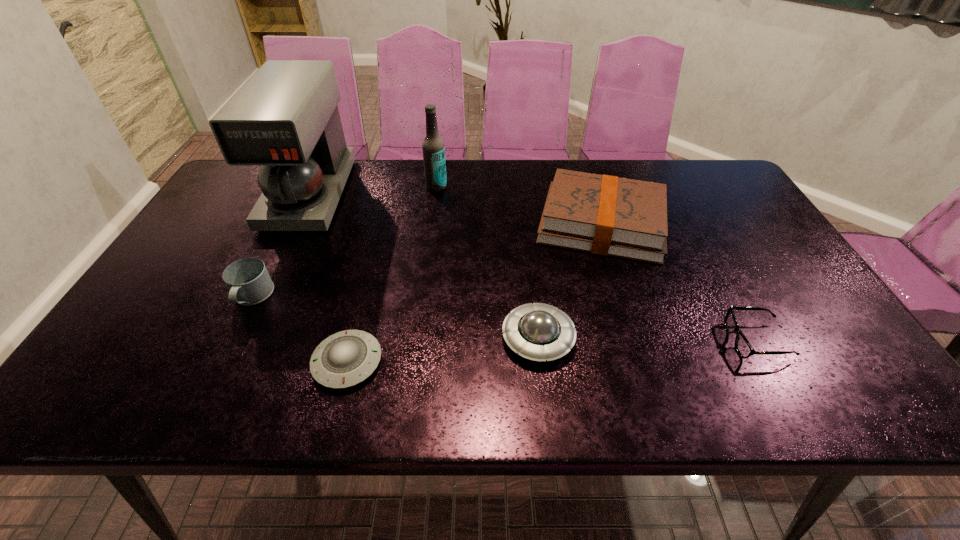
This screenshot has width=960, height=540. In order to click on hardback book present at the far edge in this screenshot , I will do `click(607, 215)`.

This screenshot has height=540, width=960. What are the coordinates of `object situated at the near edge` in the screenshot? It's located at (346, 358).

Identify the location of object positioned at the right edge. The width and height of the screenshot is (960, 540). (744, 349).

Image resolution: width=960 pixels, height=540 pixels. I want to click on vacant space at the far edge of the desktop, so click(x=673, y=181).

The width and height of the screenshot is (960, 540). I want to click on free space at the near edge, so click(x=660, y=409).

Identify the location of free space at the left edge of the desktop. This screenshot has height=540, width=960. (201, 286).

What are the coordinates of `free space at the near left corner of the desktop` in the screenshot? It's located at (120, 375).

In the image, there is a desktop. At what (x,y) coordinates should I click in order to perform the action: click on free region at the far right corner. Please return your answer as a coordinate pair (x, y). This screenshot has width=960, height=540. Looking at the image, I should click on (699, 186).

Locate an element on the screen. Image resolution: width=960 pixels, height=540 pixels. vacant area that lies between the right saucer and the fourth object from right to left is located at coordinates (488, 262).

The height and width of the screenshot is (540, 960). What are the coordinates of `unoccupied area between the left saucer and the taller saucer` in the screenshot? It's located at (443, 350).